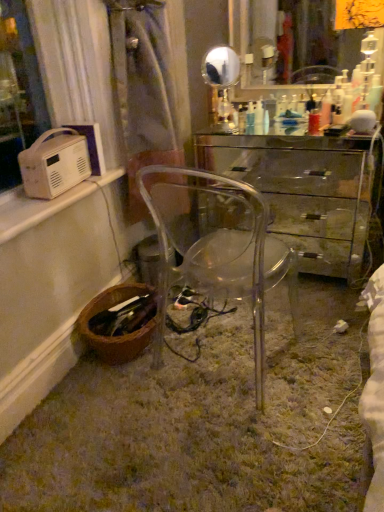
Question: Is point (77, 126) positioned closer to the camera than point (355, 251)?

Choices:
 (A) farther
 (B) closer

Answer: (B)

Question: Is white plastic radio at upper left, positioned as the 1th appliance in back-to-front order, situated inside transparent glass desk at center or outside?

Choices:
 (A) inside
 (B) outside

Answer: (B)

Question: Which is farther from the brown woven basket at lower left?

Choices:
 (A) gold metallic mirror at upper center, which is counted as the second mirror, starting from the right
 (B) transparent glass mirror at upper center, the 2th mirror positioned from the left
 (C) translucent plastic bottle at center
 (D) transparent plastic chair at center
 (E) transparent glass desk at center

Answer: (B)

Question: Which of these objects is positioned farthest from the translucent plastic bottle at center?

Choices:
 (A) white plastic radio at left, the second appliance from the back
 (B) transparent plastic chair at center
 (C) transparent glass mirror at upper center, the 1th mirror when ordered from right to left
 (D) white plastic radio at upper left, the 2th appliance from the front
 (E) brown woven basket at lower left

Answer: (C)